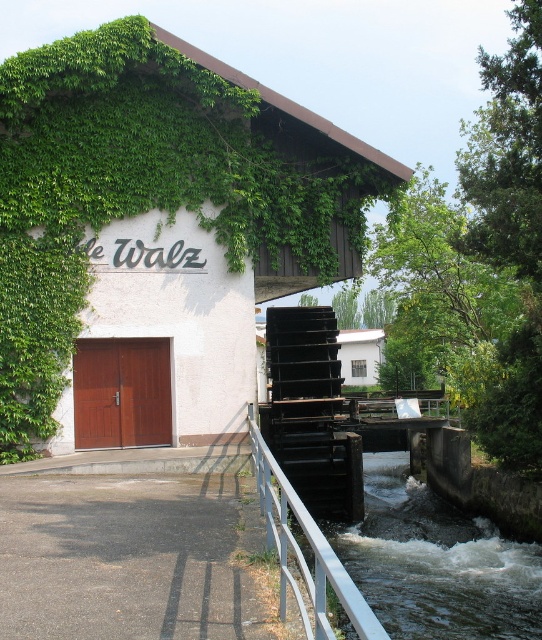
Question: Does green ivy at upper left appear on the left side of silver metallic rail at lower center?

Choices:
 (A) yes
 (B) no

Answer: (A)

Question: Which point is farther to the camera?

Choices:
 (A) (165, 444)
 (B) (306, 531)

Answer: (A)

Question: Among these objects, which one is nearest to the camera?

Choices:
 (A) silver metallic rail at lower center
 (B) green ivy at upper left

Answer: (A)

Question: Can you confirm if green ivy at upper left is positioned to the right of silver metallic rail at lower center?

Choices:
 (A) no
 (B) yes

Answer: (A)

Question: Where is green ivy at upper left located in relation to silver metallic rail at lower center in the image?

Choices:
 (A) above
 (B) below

Answer: (A)